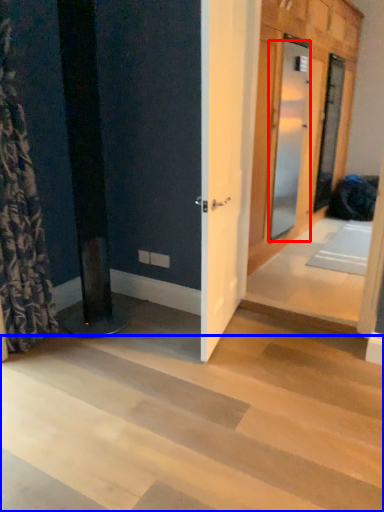
Question: Which of the following is the closest to the observer, door (highlighted by a red box) or stairwell (highlighted by a blue box)?

Choices:
 (A) door
 (B) stairwell

Answer: (B)